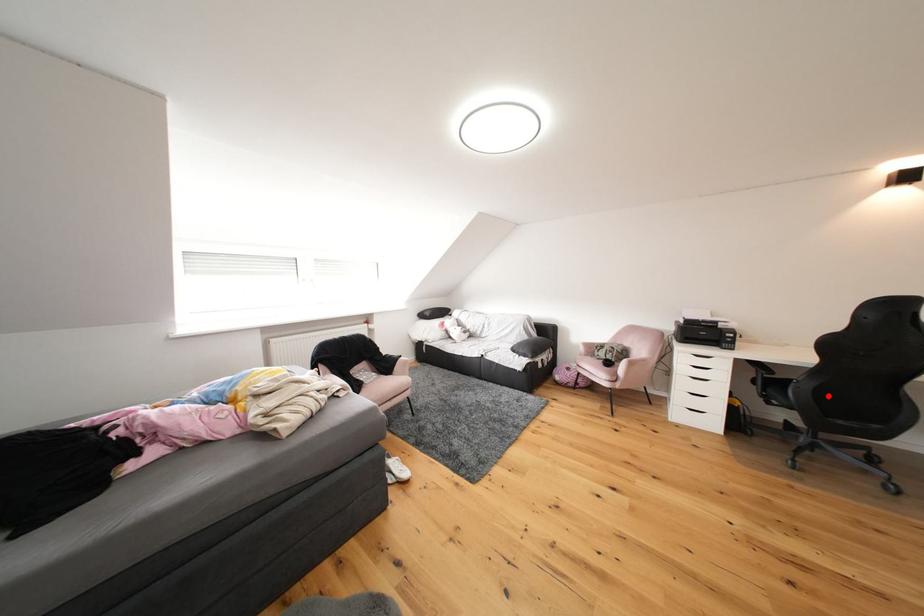
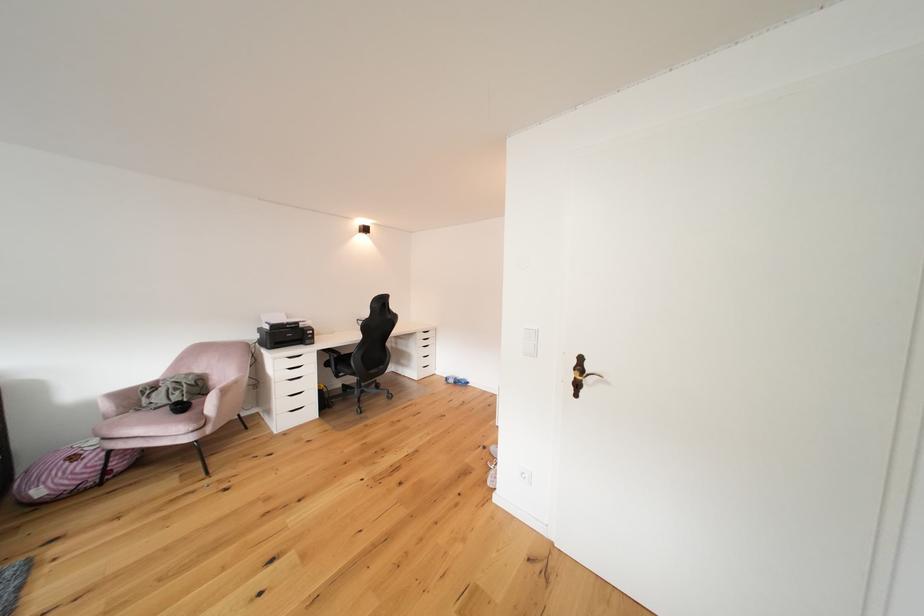
Question: I am providing you with two images of the same scene from different viewpoints. A red point is shown in image1. For the corresponding object point in image2, is it positioned nearer or farther from the camera?

Choices:
 (A) Nearer
 (B) Farther

Answer: (A)